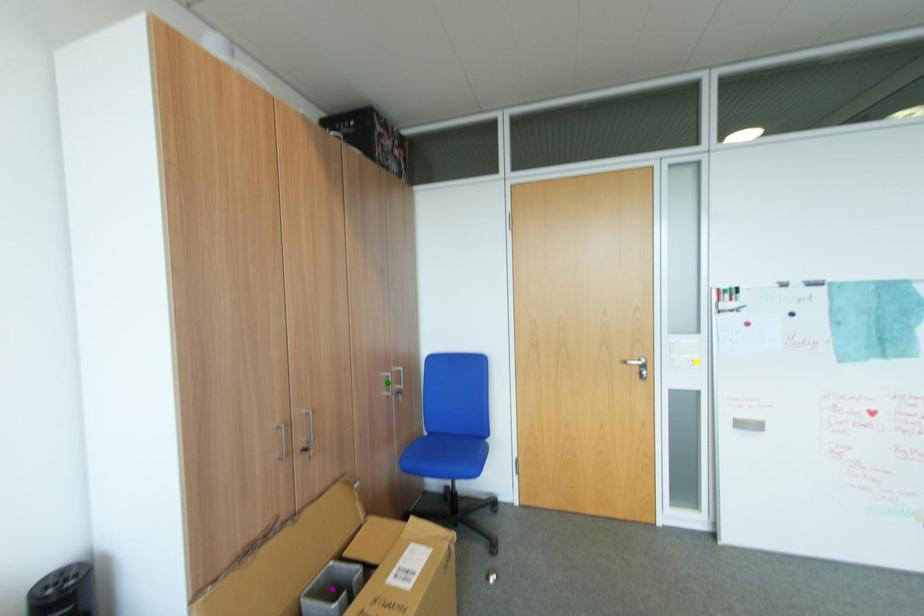
Order these from nearest to farthest:
yellow point
purple point
green point

green point < yellow point < purple point